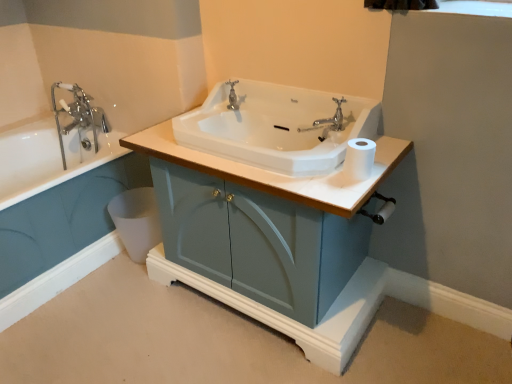
Locate an element on the screen. This screenshot has height=384, width=512. white plastic toilet bowl at lower left is located at coordinates (136, 221).

The image size is (512, 384). What do you see at coordinates (232, 96) in the screenshot? I see `polished chrome faucet at center` at bounding box center [232, 96].

In order to click on white glossy sink at center in this screenshot , I will do `click(278, 127)`.

Locate an element on the screen. white glossy bathtub at left is located at coordinates coord(53,198).

Looking at this image, between matte blue cabinet at center and chrome metallic faucet at upper left, which one appears on the right side from the viewer's perspective?

From the viewer's perspective, matte blue cabinet at center appears more on the right side.

Choose the correct answer: Is matte blue cabinet at center inside chrome metallic faucet at upper left or outside it?

matte blue cabinet at center is outside chrome metallic faucet at upper left.

From the image's perspective, would you say matte blue cabinet at center is shown under chrome metallic faucet at upper left?

Indeed, from the image's perspective, matte blue cabinet at center is shown beneath chrome metallic faucet at upper left.

From a real-world perspective, is white matte toilet paper at right located higher than polished chrome faucet at center?

No.

Considering their positions, is white matte toilet paper at right located in front of or behind polished chrome faucet at center?

Visually, white matte toilet paper at right is located in front of polished chrome faucet at center.

In the image, is white matte toilet paper at right on the left side or the right side of polished chrome faucet at center?

white matte toilet paper at right is positioned on polished chrome faucet at center's right side.

Between white matte toilet paper at right and white glossy bathtub at left, which one has less height?

With less height is white matte toilet paper at right.

Which is correct: white matte toilet paper at right is inside white glossy bathtub at left, or outside of it?

white matte toilet paper at right is located beyond the bounds of white glossy bathtub at left.

Considering the relative sizes of white matte toilet paper at right and white glossy bathtub at left in the image provided, is white matte toilet paper at right wider than white glossy bathtub at left?

No, white matte toilet paper at right is not wider than white glossy bathtub at left.

How many degrees apart are the facing directions of white matte toilet paper at right and white glossy bathtub at left?

The facing directions of white matte toilet paper at right and white glossy bathtub at left are 90.9 degrees apart.

Considering the points (70, 112) and (327, 199), which point is behind, point (70, 112) or point (327, 199)?

The point (70, 112) is farther.

From the image's perspective, is chrome metallic faucet at upper left under matte blue cabinet at center?

Actually, chrome metallic faucet at upper left appears above matte blue cabinet at center in the image.

Which of these two, chrome metallic faucet at upper left or matte blue cabinet at center, is wider?

matte blue cabinet at center is wider.

Does chrome metallic faucet at upper left turn towards matte blue cabinet at center?

No, chrome metallic faucet at upper left is not turned towards matte blue cabinet at center.

Considering the sizes of objects chrome metallic faucet at upper left and white glossy sink at center in the image provided, who is bigger, chrome metallic faucet at upper left or white glossy sink at center?

Bigger between the two is white glossy sink at center.

Find the location of a particular element. The width and height of the screenshot is (512, 384). bathtub above the white glossy sink at center (from the image's perspective) is located at coordinates pyautogui.click(x=55, y=149).

From the image's perspective, is chrome metallic faucet at upper left located beneath white glossy sink at center?

Incorrect, from the image's perspective, chrome metallic faucet at upper left is higher than white glossy sink at center.

In the image, is chrome metallic faucet at upper left positioned in front of or behind white glossy sink at center?

chrome metallic faucet at upper left is positioned farther from the viewer than white glossy sink at center.

Who is more distant, polished chrome faucet at center or chrome metallic faucet at upper left?

chrome metallic faucet at upper left is more distant.

Is polished chrome faucet at center wider than chrome metallic faucet at upper left?

No.

Who is bigger, polished chrome faucet at center or chrome metallic faucet at upper left?

chrome metallic faucet at upper left.

Who is more distant, white plastic toilet bowl at lower left or white glossy bathtub at left?

white plastic toilet bowl at lower left.

Which of these two, white plastic toilet bowl at lower left or white glossy bathtub at left, is smaller?

Smaller between the two is white plastic toilet bowl at lower left.

From a real-world perspective, is white plastic toilet bowl at lower left located higher than white glossy bathtub at left?

No.

Does white plastic toilet bowl at lower left have a lesser height compared to white glossy bathtub at left?

Indeed, white plastic toilet bowl at lower left has a lesser height compared to white glossy bathtub at left.

This screenshot has height=384, width=512. I want to click on bathtub on the left of matte blue cabinet at center, so click(x=55, y=149).

There is a white matte toilet paper at right. Find the location of `tap above it (from a real-world perspective)`. tap above it (from a real-world perspective) is located at coordinates (232, 96).

Which object lies further to the anchor point matte blue cabinet at center, white glossy sink at center or polished chrome faucet at center?

Based on the image, polished chrome faucet at center appears to be further to matte blue cabinet at center.

Estimate the real-world distances between objects in this image. Which object is further from white glossy sink at center, white glossy bathtub at left or polished chrome faucet at center?

Based on the image, white glossy bathtub at left appears to be further to white glossy sink at center.

Considering their positions, is white glossy bathtub at left positioned further to white plastic toilet bowl at lower left than white matte toilet paper at right?

white matte toilet paper at right is further to white plastic toilet bowl at lower left.

Which object lies further to the anchor point chrome metallic faucet at upper left, white glossy sink at center or white glossy bathtub at left?

white glossy sink at center is further to chrome metallic faucet at upper left.

Looking at this image, from the image, which object appears to be nearer to chrome metallic faucet at upper left, polished chrome faucet at center or white glossy bathtub at left?

Based on the image, white glossy bathtub at left appears to be nearer to chrome metallic faucet at upper left.

Estimate the real-world distances between objects in this image. Which object is further from white plastic toilet bowl at lower left, polished chrome faucet at center or white matte toilet paper at right?

The object further to white plastic toilet bowl at lower left is white matte toilet paper at right.

Based on the photo, which object lies further to the anchor point polished chrome faucet at center, white glossy bathtub at left or white matte toilet paper at right?

Among the two, white glossy bathtub at left is located further to polished chrome faucet at center.

Considering their positions, is white glossy sink at center positioned further to polished chrome faucet at center than matte blue cabinet at center?

Among the two, matte blue cabinet at center is located further to polished chrome faucet at center.

Identify the location of toilet bowl between white glossy bathtub at left and matte blue cabinet at center. (136, 221).

Identify the location of toilet bowl located between white glossy bathtub at left and white glossy sink at center in the left-right direction. This screenshot has width=512, height=384. (136, 221).

This screenshot has height=384, width=512. Identify the location of toilet bowl between chrome metallic faucet at upper left and matte blue cabinet at center in the horizontal direction. (136, 221).

Image resolution: width=512 pixels, height=384 pixels. Find the location of `toilet paper positioned between matte blue cabinet at center and polished chrome faucet at center from near to far`. toilet paper positioned between matte blue cabinet at center and polished chrome faucet at center from near to far is located at coordinates (359, 159).